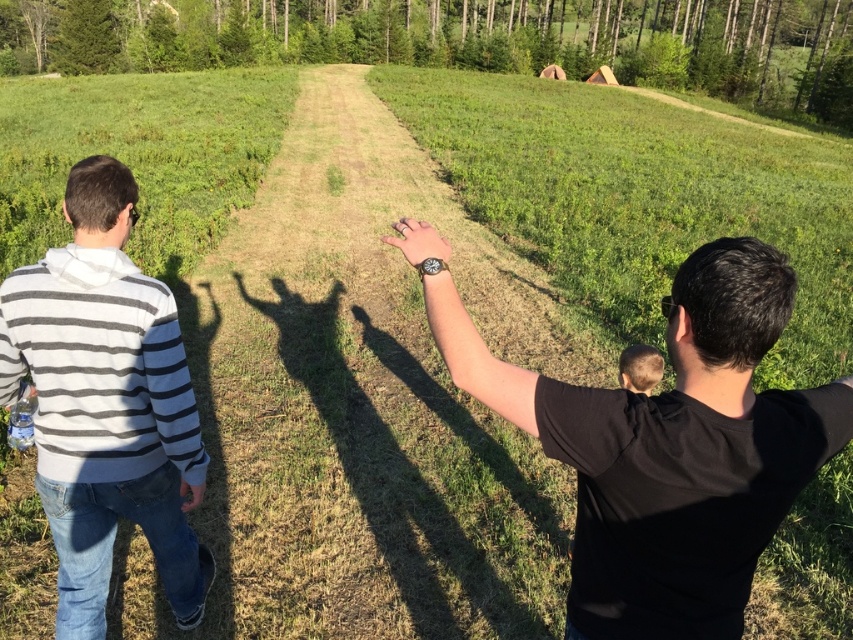
Question: Which of the following is the closest to the observer?

Choices:
 (A) matte black watch at center
 (B) white striped hoodie at left
 (C) light brown hair at center

Answer: (A)

Question: Does black matte shirt at center appear over matte black watch at center?

Choices:
 (A) no
 (B) yes

Answer: (A)

Question: Can you confirm if black matte shirt at center is positioned to the left of light brown hair at center?

Choices:
 (A) yes
 (B) no

Answer: (A)

Question: Which object appears farthest from the camera in this image?

Choices:
 (A) white striped hoodie at left
 (B) matte black watch at center
 (C) light brown hair at center
 (D) black matte shirt at center

Answer: (C)

Question: Can you confirm if white striped hoodie at left is positioned above light brown hair at center?

Choices:
 (A) yes
 (B) no

Answer: (B)

Question: Which object is positioned farthest from the matte black watch at center?

Choices:
 (A) light brown hair at center
 (B) white striped hoodie at left
 (C) black matte shirt at center

Answer: (A)